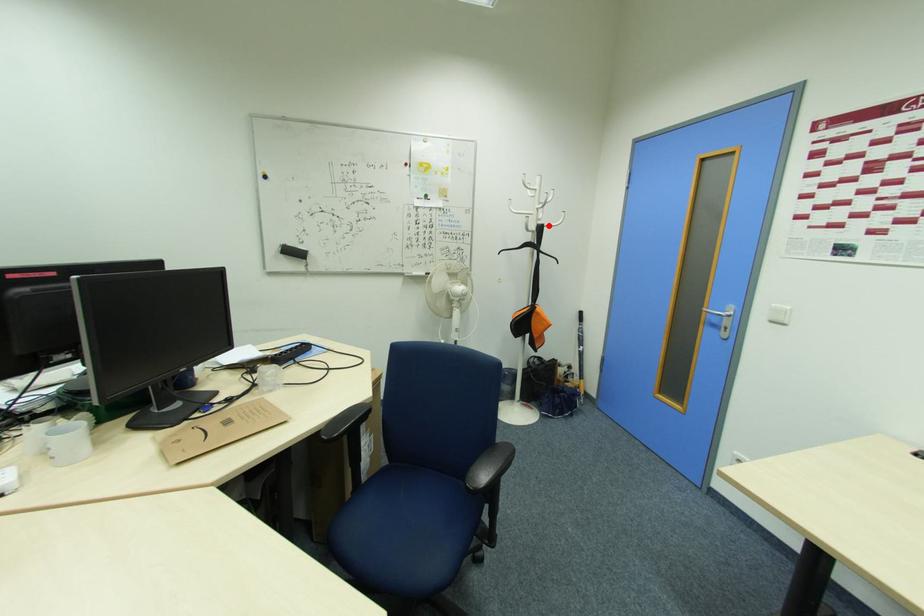
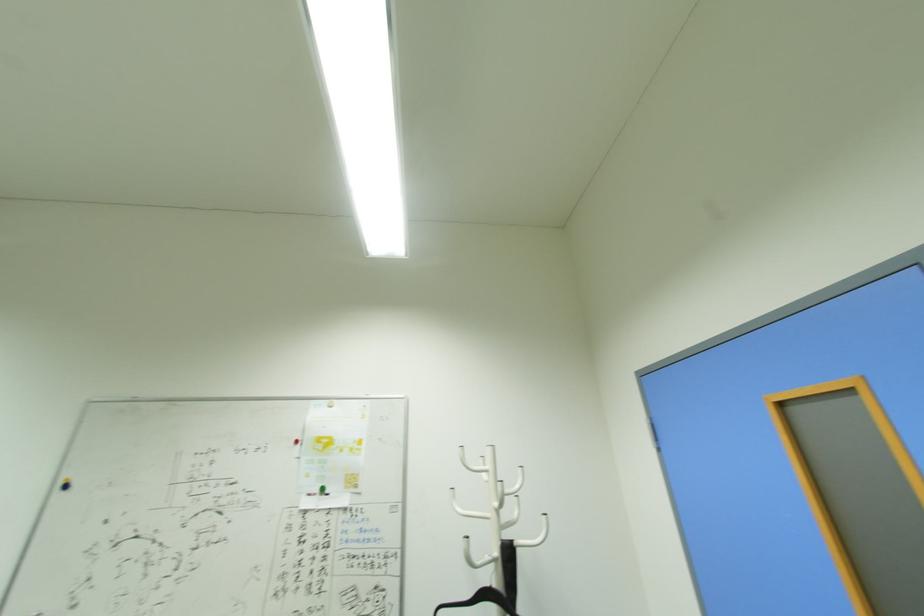
Question: A red point is marked in image1. In image2, is the corresponding 3D point closer to the camera or farther? Reply with the corresponding letter.

Choices:
 (A) The corresponding 3D point is closer.
 (B) The corresponding 3D point is farther.

Answer: (B)